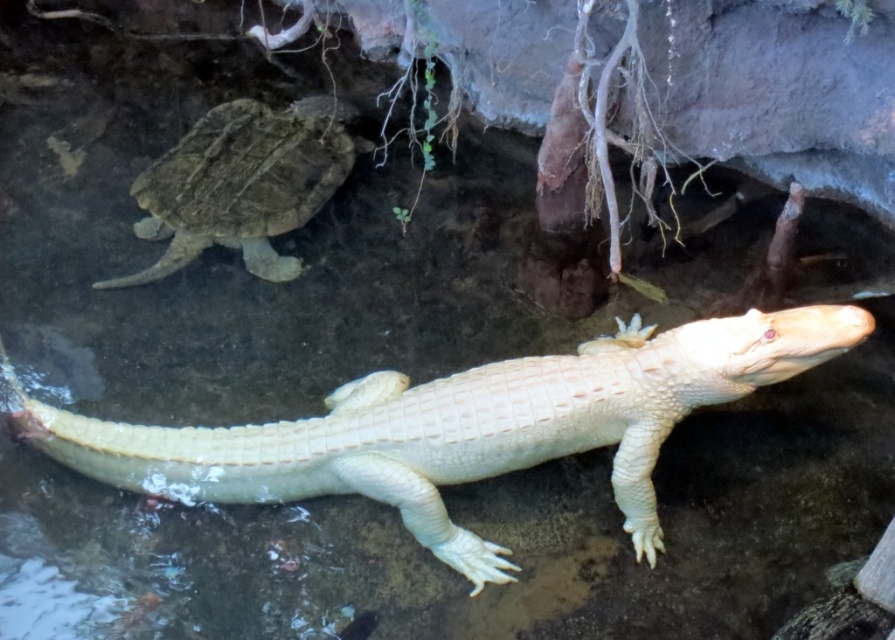
You are a wildlife photographer trying to capture a clear photo of both the white scaly crocodile at center and the leathery brown tortoise at upper left. Since your camera has a limited field of view, you need to know which animal is wider to focus on it first. Can you determine which one is wider?

The white scaly crocodile at center might be wider than leathery brown tortoise at upper left, so it is likely the wider one and should be focused on first.

Consider the image. You are a marine biologist observing the aquatic environment described. You notice the white scaly crocodile at center. Can you determine its exact coordinates in the scene?

The white scaly crocodile at center is located at point (465, 426).